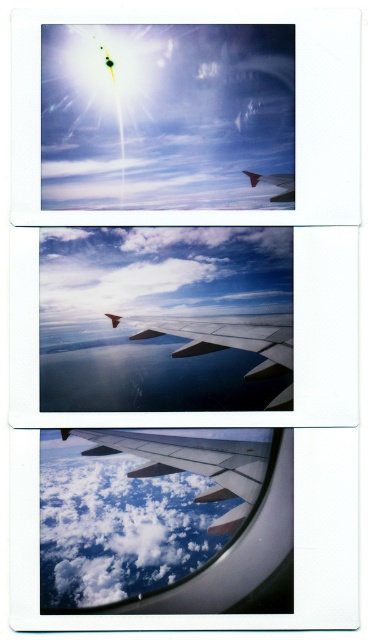
You are a pilot who wants to ensure there is enough space between the cloudy white cloud at center and the matte red wing at center for safe navigation. Based on aviation safety standards, which require a minimum separation of 30 inches between clouds and aircraft wings, is the current distance sufficient?

The distance between the cloudy white cloud at center and the matte red wing at center is 28.21 inches, which is below the required 30 inches for safe navigation. Therefore, the current separation is insufficient.

Looking at the middle panel of the triptych, you see two airplane wings labeled as the matte metallic wing at center and the matte red wing at center. Which of these wings appears taller in the image?

The matte metallic wing at center appears much taller than the matte red wing at center in the middle panel.